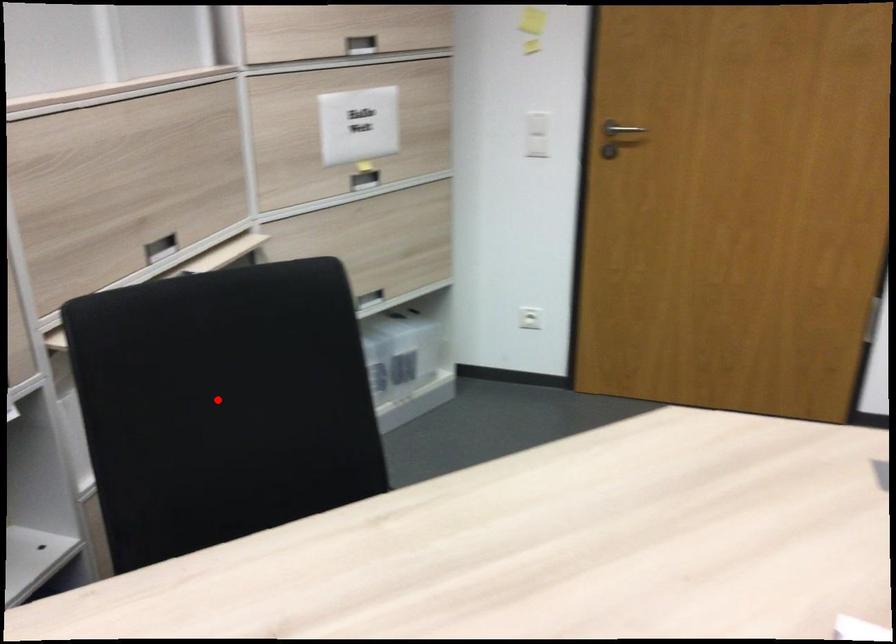
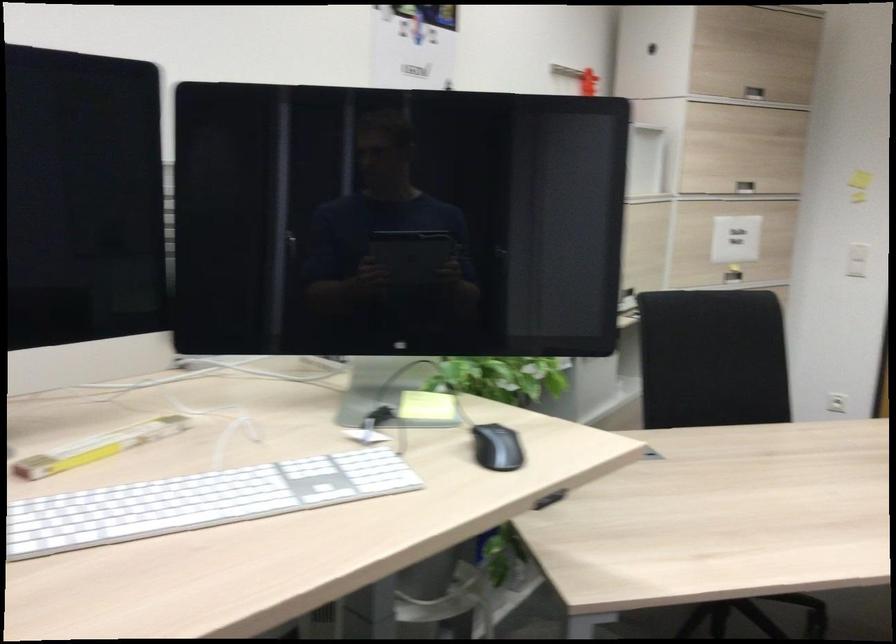
Question: I am providing you with two images of the same scene from different viewpoints. In image1, a red point is highlighted. Considering the same 3D point in image2, which of the following is correct?

Choices:
 (A) It is closer
 (B) It is farther

Answer: (B)